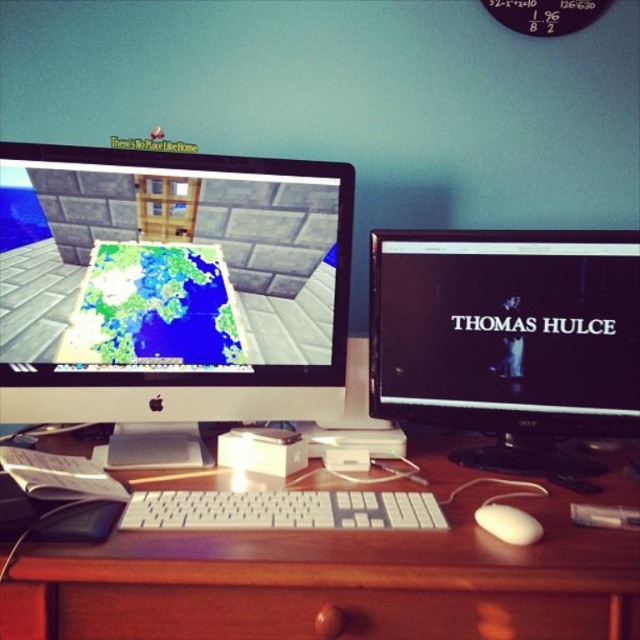
Is black glossy monitor at center positioned behind wooden at center?

Yes.

Is black glossy monitor at center thinner than wooden at center?

Indeed, black glossy monitor at center has a lesser width compared to wooden at center.

Who is more forward, (x=532, y=278) or (x=96, y=604)?

Point (x=96, y=604)

Where is `black glossy monitor at center`? black glossy monitor at center is located at coordinates (508, 339).

Which is behind, point (252, 524) or point (506, 529)?

Positioned behind is point (252, 524).

Is point (173, 499) positioned in front of point (528, 515)?

That is False.

The image size is (640, 640). What do you see at coordinates (282, 509) in the screenshot? I see `white plastic keyboard at center` at bounding box center [282, 509].

Locate an element on the screen. white plastic keyboard at center is located at coordinates (282, 509).

Between matte black monitor at center and white plastic keyboard at center, which one has less height?

white plastic keyboard at center

This screenshot has width=640, height=640. Find the location of `matte black monitor at center`. matte black monitor at center is located at coordinates (170, 285).

Identify the location of matte black monitor at center. (170, 285).